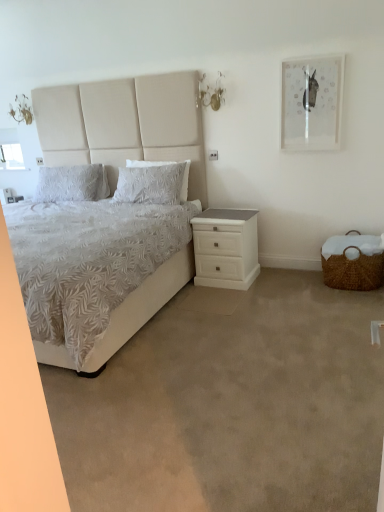
This screenshot has width=384, height=512. Identify the location of free space on the front side of white matte nightstand at lower right. (227, 296).